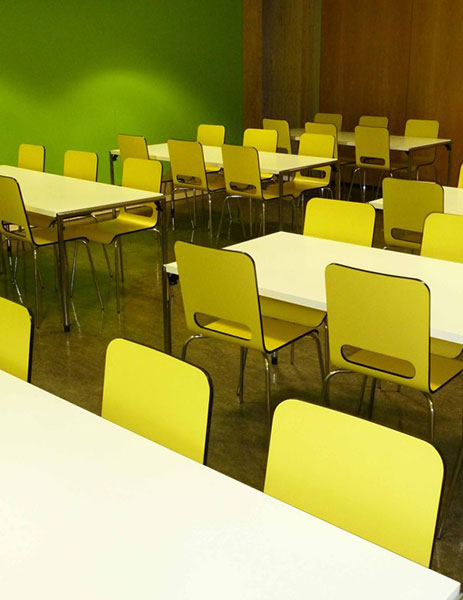
Find the location of a particular element. The height and width of the screenshot is (600, 463). white tables is located at coordinates (63, 188), (54, 454), (297, 266), (272, 158), (400, 139), (452, 195).